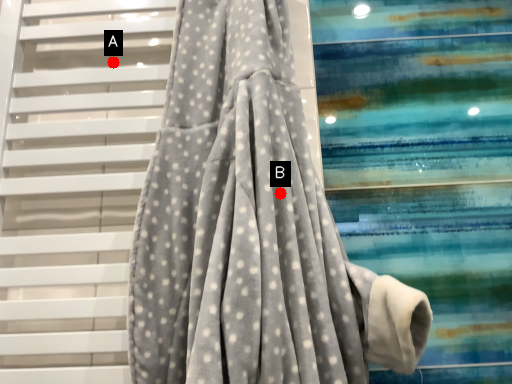
Question: Two points are circled on the image, labeled by A and B beside each circle. Which point appears closest to the camera in this image?

Choices:
 (A) A is closer
 (B) B is closer

Answer: (B)